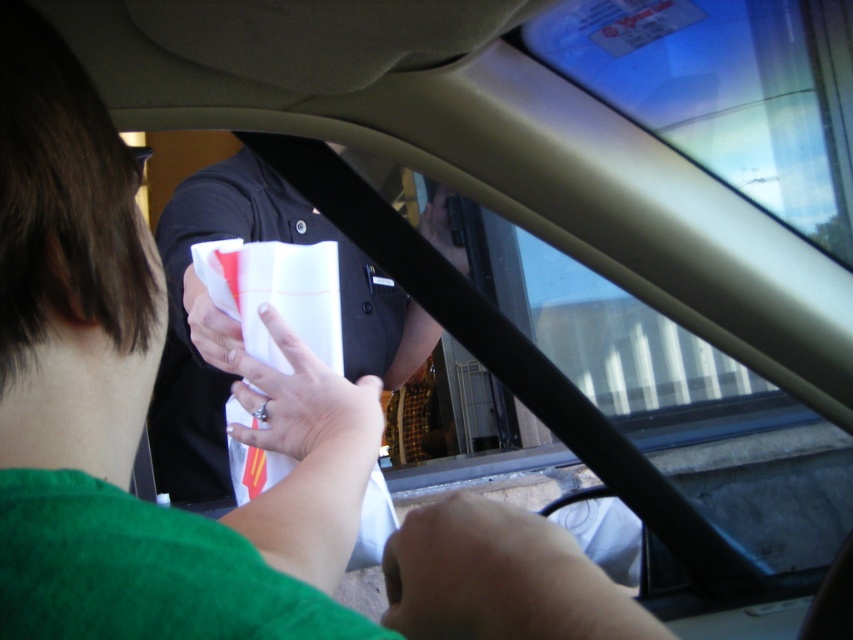
Question: Based on their relative distances, which object is nearer to the white matte paper at center?

Choices:
 (A) smooth skin hand at lower center
 (B) black plastic phone at upper center
 (C) white paper at center

Answer: (C)

Question: Can you confirm if smooth skin hand at lower center is wider than black plastic phone at upper center?

Choices:
 (A) no
 (B) yes

Answer: (B)

Question: Which point is farther to the camera?

Choices:
 (A) (341, 426)
 (B) (454, 524)

Answer: (A)

Question: Can you confirm if white matte paper at center is smaller than white paper at center?

Choices:
 (A) no
 (B) yes

Answer: (A)

Question: Can you confirm if white paper at center is positioned below black plastic phone at upper center?

Choices:
 (A) no
 (B) yes

Answer: (B)

Question: Which point appears closest to the camera in this image?

Choices:
 (A) [x=630, y=616]
 (B) [x=247, y=376]
 (C) [x=453, y=241]

Answer: (A)